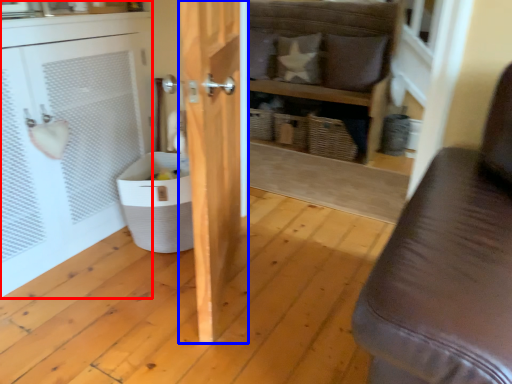
Question: Among these objects, which one is farthest to the camera, cabinetry (highlighted by a red box) or door (highlighted by a blue box)?

Choices:
 (A) cabinetry
 (B) door

Answer: (A)